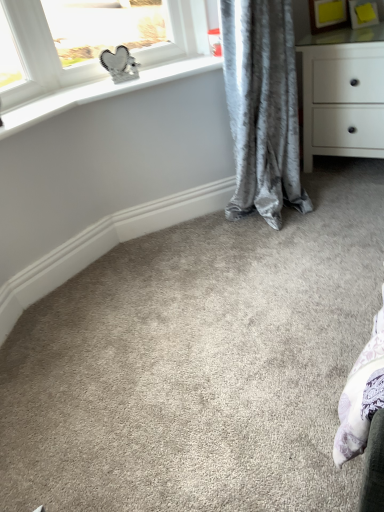
I want to click on velvet gray curtain at center, so click(262, 106).

Describe the element at coordinates (262, 106) in the screenshot. I see `velvet gray curtain at center` at that location.

Describe the element at coordinates (342, 87) in the screenshot. The width and height of the screenshot is (384, 512). I see `white matte chest of drawers at upper right` at that location.

The image size is (384, 512). Find the location of `white matte chest of drawers at upper right`. white matte chest of drawers at upper right is located at coordinates (342, 87).

Measure the distance between white matte chest of drawers at upper right and camera.

6.15 feet.

Find the location of a particular element. This screenshot has height=512, width=384. velvet gray curtain at center is located at coordinates (262, 106).

In the image, is velvet gray curtain at center on the left side or the right side of white matte chest of drawers at upper right?

In the image, velvet gray curtain at center appears on the left side of white matte chest of drawers at upper right.

Is velvet gray curtain at center in front of white matte chest of drawers at upper right?

Yes.

Is point (273, 87) positioned behind point (380, 122)?

No.

From the image's perspective, is velvet gray curtain at center positioned above or below white matte chest of drawers at upper right?

velvet gray curtain at center is below white matte chest of drawers at upper right.

From a real-world perspective, is velvet gray curtain at center located beneath white matte chest of drawers at upper right?

Incorrect, from a real-world perspective, velvet gray curtain at center is higher than white matte chest of drawers at upper right.

In terms of width, does velvet gray curtain at center look wider or thinner when compared to white matte chest of drawers at upper right?

In the image, velvet gray curtain at center appears to be more narrow than white matte chest of drawers at upper right.

Considering the sizes of objects velvet gray curtain at center and white matte chest of drawers at upper right in the image provided, who is taller, velvet gray curtain at center or white matte chest of drawers at upper right?

velvet gray curtain at center is taller.

Who is bigger, velvet gray curtain at center or white matte chest of drawers at upper right?

velvet gray curtain at center.

Is velvet gray curtain at center spatially inside white matte chest of drawers at upper right, or outside of it?

velvet gray curtain at center is located beyond the bounds of white matte chest of drawers at upper right.

Would you consider velvet gray curtain at center to be distant from white matte chest of drawers at upper right?

velvet gray curtain at center is near white matte chest of drawers at upper right, not far away.

Is white matte chest of drawers at upper right at the back of velvet gray curtain at center?

No, velvet gray curtain at center is not facing away from white matte chest of drawers at upper right.

Can you tell me how much velvet gray curtain at center and white matte chest of drawers at upper right differ in facing direction?

91.6 degrees.

Measure the distance from velvet gray curtain at center to white matte chest of drawers at upper right.

velvet gray curtain at center is 16.39 inches away from white matte chest of drawers at upper right.

Locate an element on the screen. Image resolution: width=384 pixels, height=512 pixels. curtain that is above the white matte chest of drawers at upper right (from a real-world perspective) is located at coordinates (262, 106).

Considering the relative positions of white matte chest of drawers at upper right and velvet gray curtain at center in the image provided, is white matte chest of drawers at upper right to the left of velvet gray curtain at center from the viewer's perspective?

No, white matte chest of drawers at upper right is not to the left of velvet gray curtain at center.

Which object is closer to the camera, white matte chest of drawers at upper right or velvet gray curtain at center?

velvet gray curtain at center is more forward.

Between point (380, 75) and point (284, 158), which one is positioned in front?

The point (380, 75) is closer.

From the picture: From the image's perspective, which one is positioned higher, white matte chest of drawers at upper right or velvet gray curtain at center?

white matte chest of drawers at upper right is shown above in the image.

Looking at this image, from a real-world perspective, between white matte chest of drawers at upper right and velvet gray curtain at center, who is vertically higher?

From a 3D spatial view, velvet gray curtain at center is above.

Is white matte chest of drawers at upper right thinner than velvet gray curtain at center?

No, white matte chest of drawers at upper right is not thinner than velvet gray curtain at center.

Is white matte chest of drawers at upper right taller or shorter than velvet gray curtain at center?

Considering their sizes, white matte chest of drawers at upper right has less height than velvet gray curtain at center.

Looking at this image, which of these two, white matte chest of drawers at upper right or velvet gray curtain at center, is bigger?

velvet gray curtain at center is bigger.

Is velvet gray curtain at center located within white matte chest of drawers at upper right?

No, white matte chest of drawers at upper right does not contain velvet gray curtain at center.

Looking at this image, can you see white matte chest of drawers at upper right touching velvet gray curtain at center?

white matte chest of drawers at upper right and velvet gray curtain at center are not in contact.

Could you tell me if white matte chest of drawers at upper right is turned towards velvet gray curtain at center?

Yes, white matte chest of drawers at upper right is facing velvet gray curtain at center.

Measure the distance between white matte chest of drawers at upper right and velvet gray curtain at center.

white matte chest of drawers at upper right is 16.39 inches away from velvet gray curtain at center.

This screenshot has height=512, width=384. I want to click on the chest of drawers beneath the velvet gray curtain at center (from a real-world perspective), so click(342, 87).

Find the location of `the chest of drawers located underneath the velvet gray curtain at center (from a real-world perspective)`. the chest of drawers located underneath the velvet gray curtain at center (from a real-world perspective) is located at coordinates (342, 87).

Identify the location of the chest of drawers behind the velvet gray curtain at center. (342, 87).